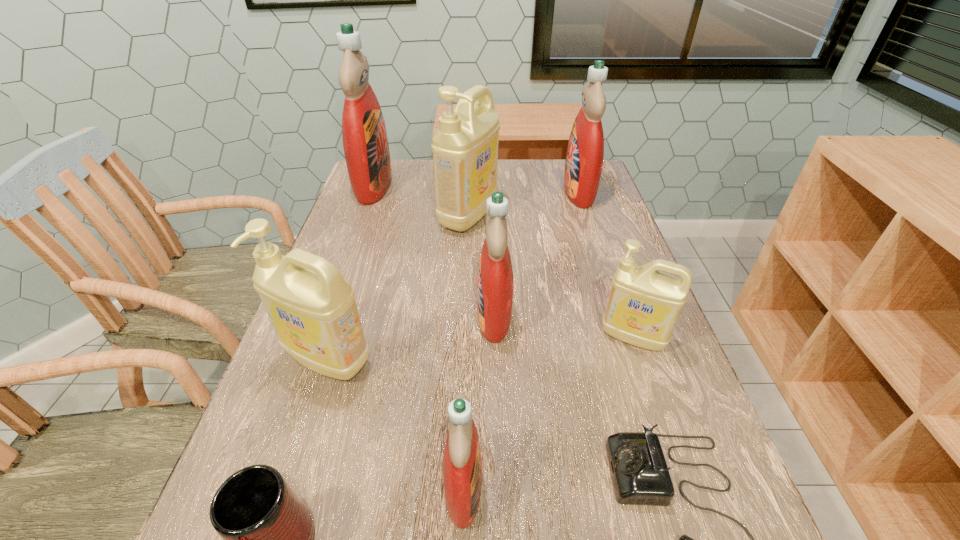
This screenshot has height=540, width=960. I want to click on free space that satisfies the following two spatial constraints: 1. on the front surface of the biggest red detergent; 2. on the right side of the rightmost beige detergent, so click(319, 337).

Where is `free spot that satisfies the following two spatial constraints: 1. on the front surface of the third farthest red detergent; 2. on the left side of the smallest beige detergent`? The image size is (960, 540). free spot that satisfies the following two spatial constraints: 1. on the front surface of the third farthest red detergent; 2. on the left side of the smallest beige detergent is located at coordinates point(494,337).

The height and width of the screenshot is (540, 960). Identify the location of free space in the image that satisfies the following two spatial constraints: 1. on the front side of the rightmost beige detergent; 2. on the front surface of the smallest red detergent. (684, 488).

Locate an element on the screen. Image resolution: width=960 pixels, height=540 pixels. free spot that satisfies the following two spatial constraints: 1. on the front surface of the rightmost beige detergent; 2. on the left side of the tallest object is located at coordinates (319, 337).

The width and height of the screenshot is (960, 540). Identify the location of vacant space that satisfies the following two spatial constraints: 1. on the front surface of the smallest beige detergent; 2. on the left side of the tallest detergent. (319, 337).